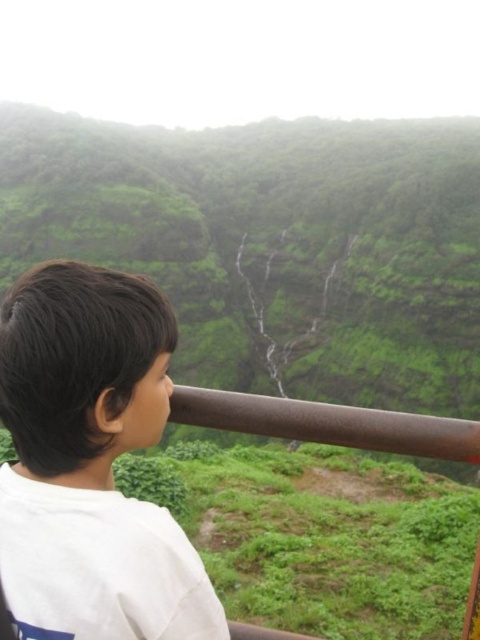
Which is below, green matte mountain at upper center or white matte shirt at left?

Positioned lower is white matte shirt at left.

Is point (301, 234) behind point (52, 477)?

Yes, point (301, 234) is farther from viewer.

Is point (344, 289) positioned behind point (59, 307)?

Yes.

Where is `green matte mountain at upper center`? This screenshot has width=480, height=640. green matte mountain at upper center is located at coordinates (273, 244).